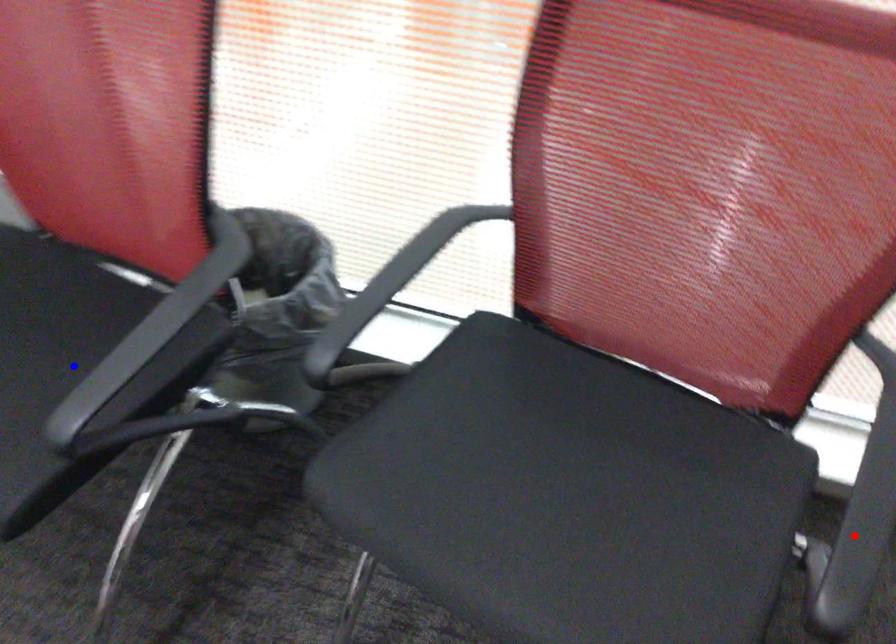
Question: In the image, two points are highlighted. Which point is nearer to the camera? Reply with the corresponding letter.

Choices:
 (A) blue point
 (B) red point

Answer: (B)